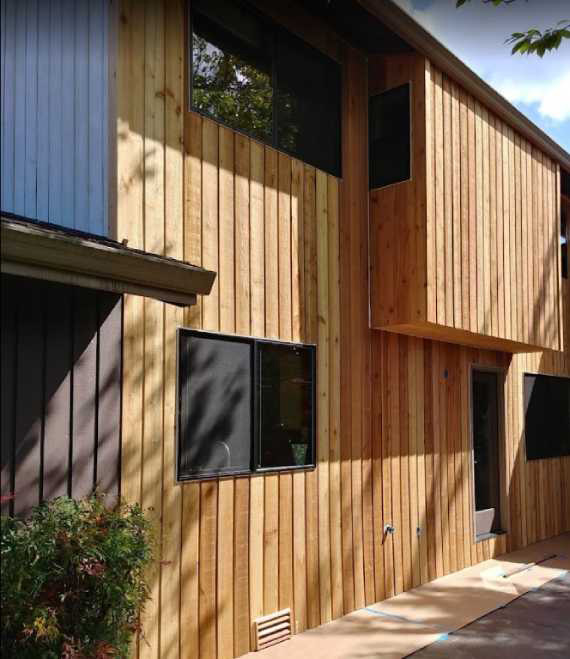
You are a GUI agent. You are given a task and a screenshot of the screen. Output one action in this format:
    pyautogui.click(x=<x>, y=<y>)
    Task: Click on the door
    Image resolution: width=570 pixels, height=659 pixels.
    Given the screenshot: What is the action you would take?
    pyautogui.click(x=486, y=527)